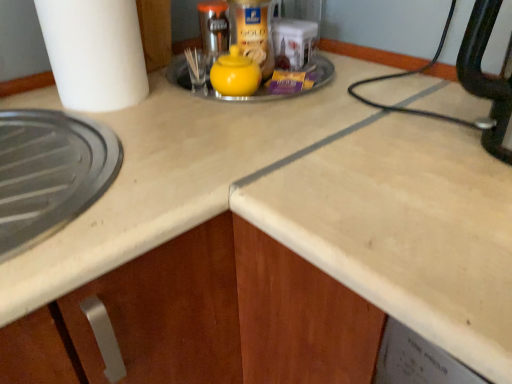
Image resolution: width=512 pixels, height=384 pixels. Describe the element at coordinates (282, 95) in the screenshot. I see `yellow matte sugar bowl at center` at that location.

The width and height of the screenshot is (512, 384). I want to click on white matte paper towel at left, so click(x=94, y=53).

Is white matte paper towel at left positioned far away from yellow matte sugar bowl at center?

No.

Locate an element on the screen. The image size is (512, 384). sink lying below the white matte paper towel at left (from the image's perspective) is located at coordinates (282, 95).

Considering the positions of points (95, 76) and (209, 92), is point (95, 76) farther from camera compared to point (209, 92)?

No.

Is white matte paper towel at left aimed at yellow matte sugar bowl at center?

No, white matte paper towel at left is not oriented towards yellow matte sugar bowl at center.

From the image's perspective, between yellow matte teapot at center and white matte paper towel at left, who is located below?

yellow matte teapot at center is shown below in the image.

Is white matte paper towel at left at the back of yellow matte teapot at center?

No, yellow matte teapot at center's orientation is not away from white matte paper towel at left.

Does yellow matte sugar bowl at center contain white matte paper towel at left?

No, white matte paper towel at left is not surrounded by yellow matte sugar bowl at center.

Considering the sizes of objects yellow matte sugar bowl at center and white matte paper towel at left in the image provided, who is taller, yellow matte sugar bowl at center or white matte paper towel at left?

white matte paper towel at left is taller.

From the image's perspective, who appears lower, yellow matte teapot at center or yellow matte sugar bowl at center?

yellow matte teapot at center.

Is point (240, 72) farther from camera compared to point (260, 86)?

No, it is not.

Are yellow matte teapot at center and yellow matte sugar bowl at center beside each other?

Yes, the surface of yellow matte teapot at center is in contact with yellow matte sugar bowl at center.

Who is smaller, white matte paper towel at left or yellow matte teapot at center?

Smaller between the two is yellow matte teapot at center.

Is white matte paper towel at left inside or outside of yellow matte teapot at center?

white matte paper towel at left is not inside yellow matte teapot at center, it's outside.

Does point (82, 71) lie behind point (220, 58)?

No, (82, 71) is closer to viewer.

Measure the distance from white matte paper towel at left to yellow matte teapot at center.

The distance of white matte paper towel at left from yellow matte teapot at center is 8.01 inches.

Is yellow matte sugar bowl at center not near yellow matte teapot at center?

No, yellow matte sugar bowl at center is not far from yellow matte teapot at center.

Which object is closer to the camera taking this photo, yellow matte sugar bowl at center or yellow matte teapot at center?

yellow matte teapot at center is more forward.

Which is in front, point (260, 96) or point (253, 79)?

The point (253, 79) is closer to the camera.

Is yellow matte sugar bowl at center shorter than yellow matte teapot at center?

Correct, yellow matte sugar bowl at center is not as tall as yellow matte teapot at center.

Locate an element on the screen. The height and width of the screenshot is (384, 512). paper towel on the left of yellow matte sugar bowl at center is located at coordinates (94, 53).

Where is `paper towel above the yellow matte teapot at center (from a real-world perspective)`? paper towel above the yellow matte teapot at center (from a real-world perspective) is located at coordinates point(94,53).

Looking at the image, which one is located closer to yellow matte sugar bowl at center, white matte paper towel at left or yellow matte teapot at center?

yellow matte teapot at center is closer to yellow matte sugar bowl at center.

Based on their spatial positions, is yellow matte sugar bowl at center or yellow matte teapot at center closer to white matte paper towel at left?

The object closer to white matte paper towel at left is yellow matte sugar bowl at center.

Based on their spatial positions, is yellow matte teapot at center or white matte paper towel at left closer to yellow matte sugar bowl at center?

Among the two, yellow matte teapot at center is located nearer to yellow matte sugar bowl at center.

Based on their spatial positions, is white matte paper towel at left or yellow matte sugar bowl at center closer to yellow matte teapot at center?

yellow matte sugar bowl at center.

From the image, which object appears to be farther from white matte paper towel at left, yellow matte teapot at center or yellow matte sugar bowl at center?

The object further to white matte paper towel at left is yellow matte teapot at center.

Which object lies nearer to the anchor point yellow matte teapot at center, yellow matte sugar bowl at center or white matte paper towel at left?

yellow matte sugar bowl at center is closer to yellow matte teapot at center.

Image resolution: width=512 pixels, height=384 pixels. What are the coordinates of `tea pot between white matte paper towel at left and yellow matte sugar bowl at center from left to right` in the screenshot? It's located at (234, 74).